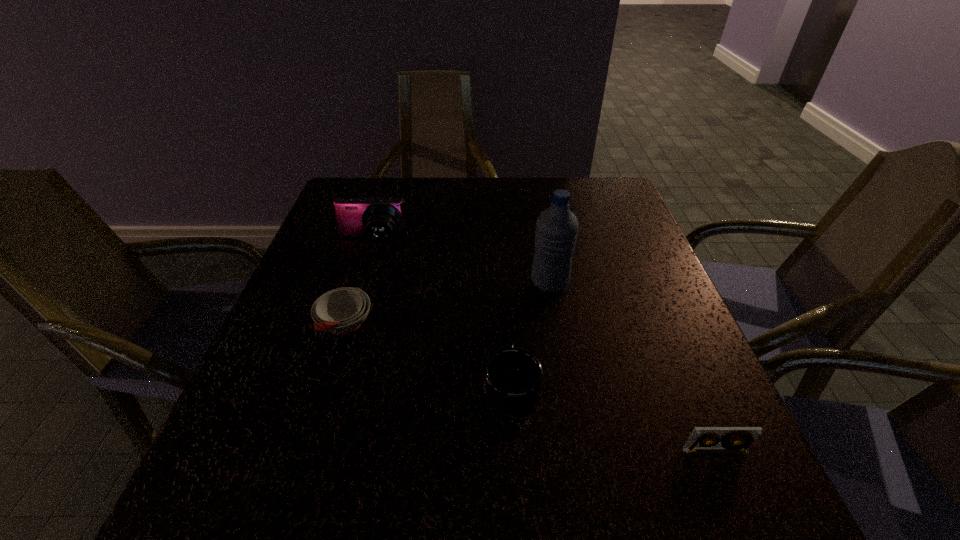
At what (x,y) coordinates should I click in order to perform the action: click on blank space located 0.180m on the front-facing side of the camera. Please return your answer as a coordinate pair (x, y). Looking at the image, I should click on (353, 304).

Where is `blank space located 0.070m at the front of the rightmost object with visible reels`? The height and width of the screenshot is (540, 960). blank space located 0.070m at the front of the rightmost object with visible reels is located at coordinates (735, 501).

Find the location of a particular element. The height and width of the screenshot is (540, 960). free space located 0.230m with the handle on the side of the mug is located at coordinates (505, 279).

This screenshot has height=540, width=960. I want to click on free space located with the handle on the side of the mug, so click(503, 258).

You are a GUI agent. You are given a task and a screenshot of the screen. Output one action in this format:
    pyautogui.click(x=<x>, y=<y>)
    Task: Click on the free space located 0.050m with the handle on the side of the mug
    The width and height of the screenshot is (960, 540).
    Given the screenshot: What is the action you would take?
    pyautogui.click(x=509, y=339)

Locate an element on the screen. This screenshot has width=960, height=540. free space located on the front of the soup bowl is located at coordinates (326, 387).

This screenshot has height=540, width=960. Identify the location of camera that is at the left edge. (379, 219).

Image resolution: width=960 pixels, height=540 pixels. Find the location of `soup bowl present at the left edge`. soup bowl present at the left edge is located at coordinates (341, 311).

At what (x,y) coordinates should I click in order to perform the action: click on object that is at the right edge. Please return your answer as a coordinate pair (x, y). This screenshot has width=960, height=540. Looking at the image, I should click on (737, 439).

In the image, there is a desktop. Where is `vacant space at the far edge`? vacant space at the far edge is located at coordinates (539, 193).